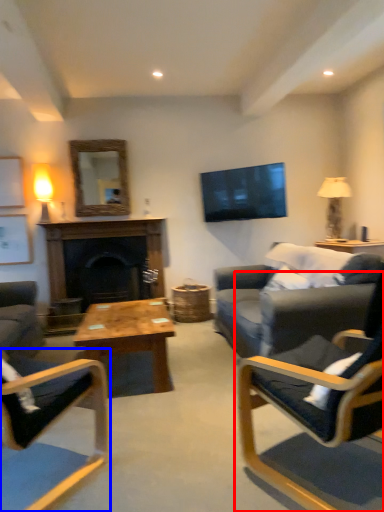
Question: Which object is further to the camera taking this photo, chair (highlighted by a red box) or chair (highlighted by a blue box)?

Choices:
 (A) chair
 (B) chair

Answer: (B)